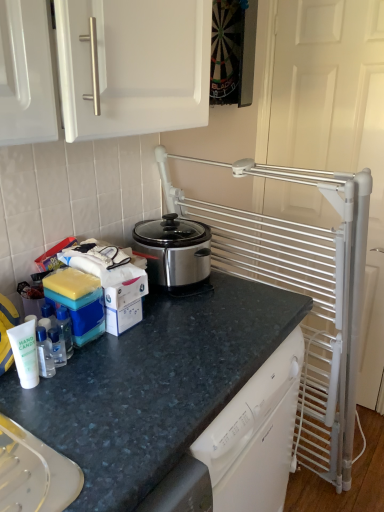
Identify the location of blank space above granite dark blue countertop at center (from a real-world perspective). Image resolution: width=384 pixels, height=512 pixels. (194, 322).